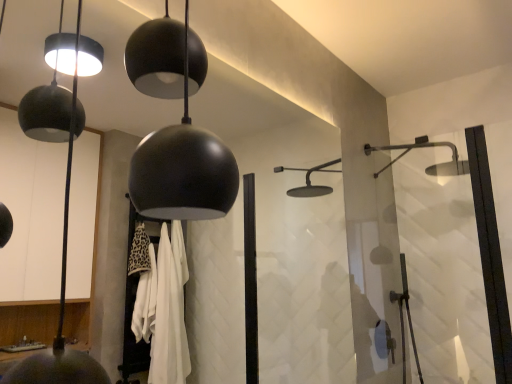
In order to face transparent glass shower door at right, should I rotate leftwards or rightwards?

To align with it, rotate right about 22.128°.

Where is `transparent glass shower door at right`? Image resolution: width=512 pixels, height=384 pixels. transparent glass shower door at right is located at coordinates (454, 266).

Based on the photo, what is the approximate height of transparent glass shower door at right?

36.60 inches.

Image resolution: width=512 pixels, height=384 pixels. Describe the element at coordinates (454, 266) in the screenshot. I see `transparent glass shower door at right` at that location.

Find the location of a particular element. Image resolution: width=512 pixels, height=384 pixels. transparent glass shower door at right is located at coordinates (454, 266).